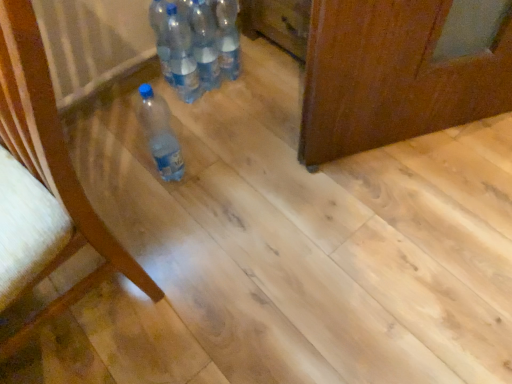
Locate an element on the screen. This screenshot has height=384, width=512. vacant area that is situated to the right of translucent plastic bottles at center, which is the 2th bottle in top-to-bottom order is located at coordinates (261, 82).